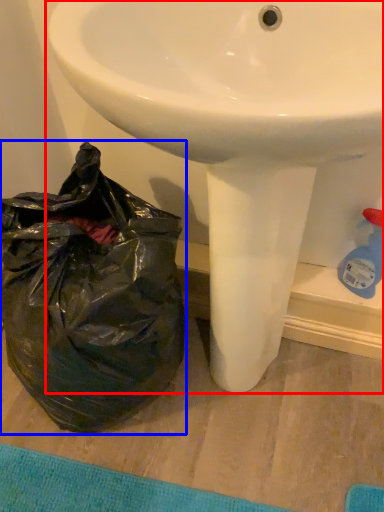
Question: Among these objects, which one is nearest to the camera, sink (highlighted by a red box) or plastic bag (highlighted by a blue box)?

Choices:
 (A) sink
 (B) plastic bag

Answer: (A)